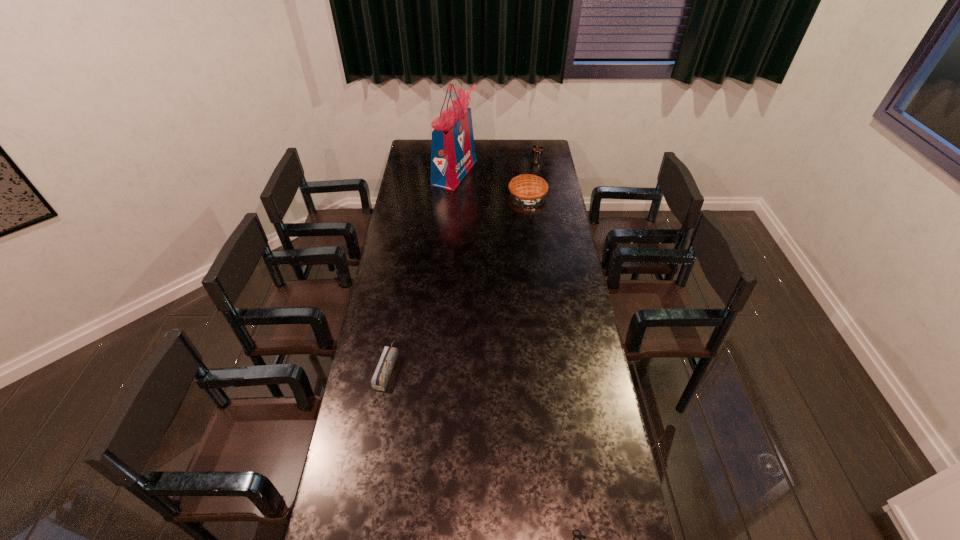
This screenshot has width=960, height=540. Find the location of `grocery bag at the far edge`. grocery bag at the far edge is located at coordinates (452, 150).

Find the location of a particular element. can at the far edge is located at coordinates (537, 151).

At what (x,y) coordinates should I click in order to perform the action: click on object present at the left edge. Please return your answer as a coordinate pair (x, y). The image size is (960, 540). Looking at the image, I should click on (379, 381).

Where is `can present at the right edge`? The width and height of the screenshot is (960, 540). can present at the right edge is located at coordinates (537, 151).

At what (x,y) coordinates should I click in order to perform the action: click on pie at the right edge. Please return your answer as a coordinate pair (x, y). This screenshot has height=540, width=960. Looking at the image, I should click on (529, 189).

Identify the location of object positioned at the far right corner. The height and width of the screenshot is (540, 960). (537, 151).

In the image, there is a desktop. Where is `vacant space at the far edge`? This screenshot has width=960, height=540. vacant space at the far edge is located at coordinates (496, 145).

You are a GUI agent. You are given a task and a screenshot of the screen. Output one action in this format:
    pyautogui.click(x=<x>, y=<y>)
    Task: Click on the vacant area at the left edge
    The height and width of the screenshot is (540, 960).
    Given the screenshot: What is the action you would take?
    pyautogui.click(x=377, y=328)

Locate an element on the screen. This screenshot has width=960, height=540. vacant area at the right edge of the desktop is located at coordinates (546, 231).

The height and width of the screenshot is (540, 960). What are the coordinates of `vacant space at the far left corner of the desktop` in the screenshot? It's located at (418, 155).